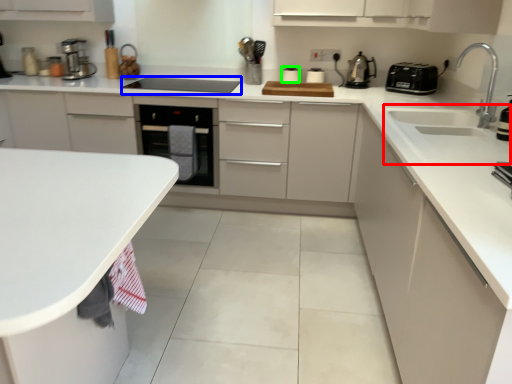
Question: Which is nearer to the sink (highlighted by a red box)? appliance (highlighted by a blue box) or appliance (highlighted by a green box).

Choices:
 (A) appliance
 (B) appliance

Answer: (B)